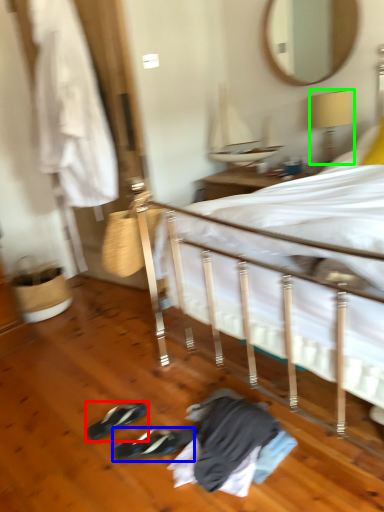
Question: Considering the real-world distances, which object is closest to footwear (highlighted by a red box)? footwear (highlighted by a blue box) or lamp (highlighted by a green box).

Choices:
 (A) footwear
 (B) lamp

Answer: (A)